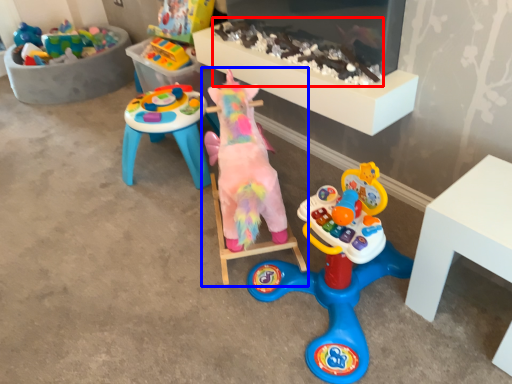
Question: Which of the following is the farthest to the observer, toy (highlighted by a red box) or toy (highlighted by a blue box)?

Choices:
 (A) toy
 (B) toy

Answer: (A)